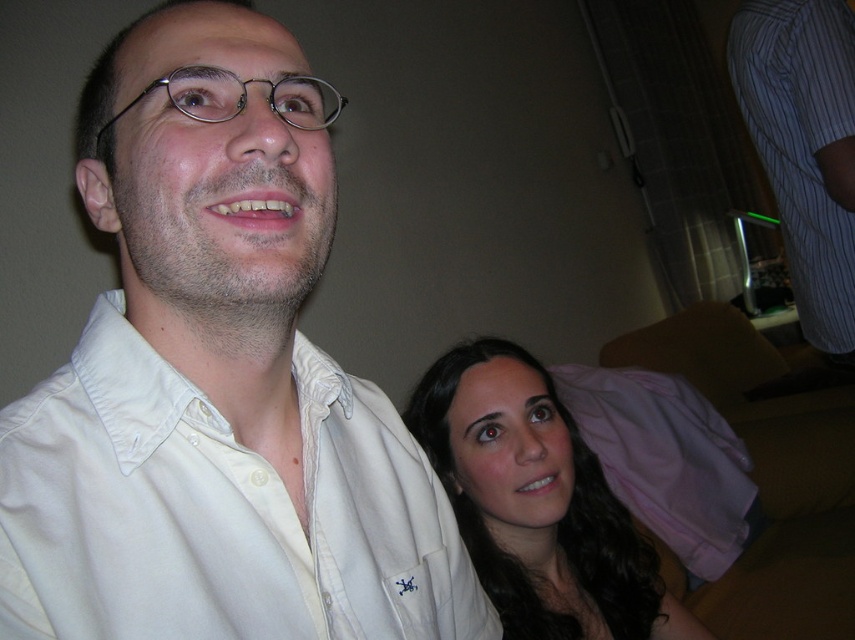
Based on the scene described, which object has a greater width between the dark brown hair at lower right and the striped cotton dress shirt at upper right?

The dark brown hair at lower right has a greater width than the striped cotton dress shirt at upper right according to the description.

You are taking a photo of two people in a room. You want to focus on the person closer to the camera. Which point should you focus on, point (x=156, y=278) or point (x=498, y=541)?

Point (x=156, y=278) is closer to the camera than point (x=498, y=541), so you should focus on point (x=156, y=278) to capture the person closer to the camera.